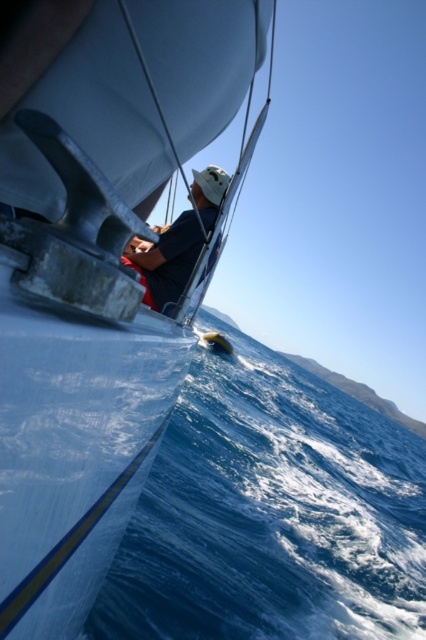
Question: Which point is closer to the camera?

Choices:
 (A) white matte sailboat at center
 (B) blue water at lower left

Answer: (A)

Question: Which is nearer to the blue water at lower left?

Choices:
 (A) white matte sailboat at center
 (B) dark blue fabric at center

Answer: (B)

Question: Does blue water at lower left have a lesser width compared to dark blue fabric at center?

Choices:
 (A) yes
 (B) no

Answer: (B)

Question: Based on their relative distances, which object is farther from the dark blue fabric at center?

Choices:
 (A) blue water at lower left
 (B) white matte sailboat at center

Answer: (A)

Question: Does white matte sailboat at center have a greater width compared to blue water at lower left?

Choices:
 (A) yes
 (B) no

Answer: (B)

Question: Is blue water at lower left to the right of dark blue fabric at center from the viewer's perspective?

Choices:
 (A) yes
 (B) no

Answer: (A)